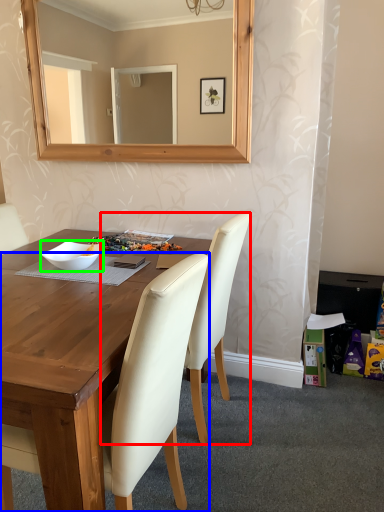
Question: Which is nearer to the chair (highlighted by a red box)? chair (highlighted by a blue box) or bowl (highlighted by a green box).

Choices:
 (A) chair
 (B) bowl

Answer: (A)